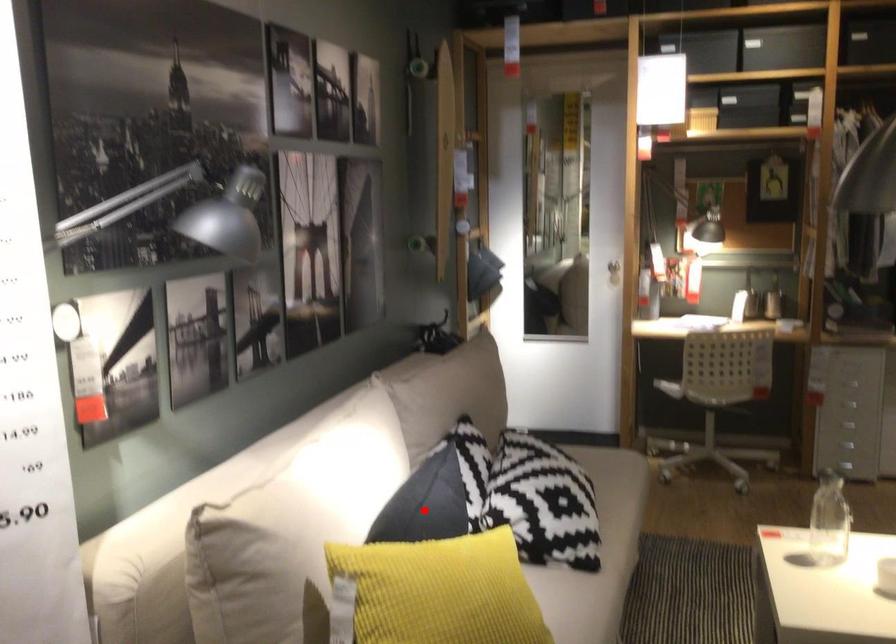
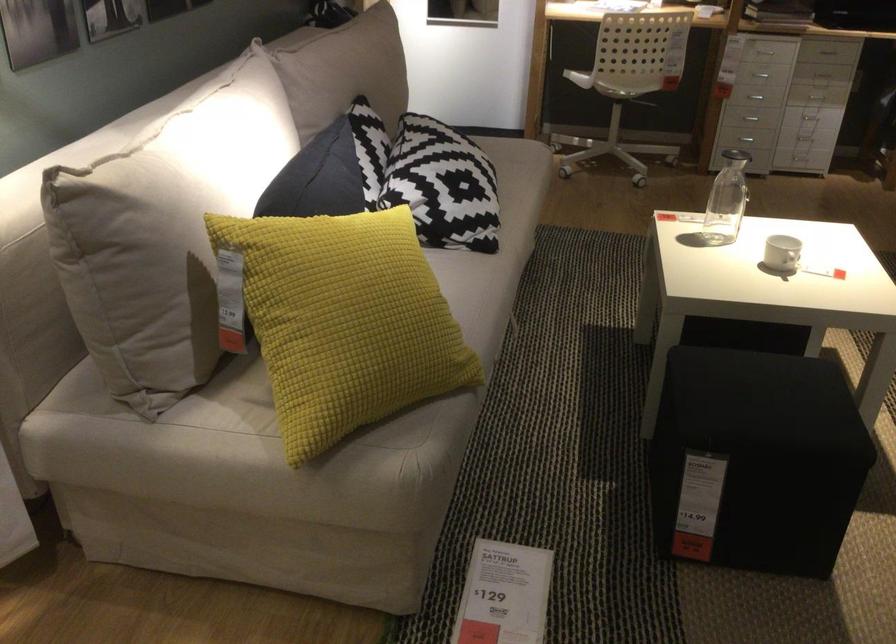
Where in the second image is the point corresponding to the highlighted location from the first image?

(317, 178)